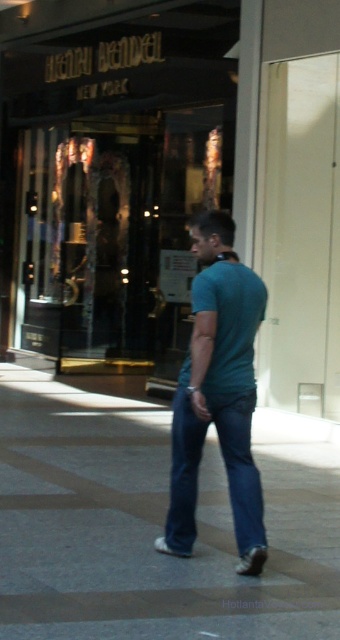
Is smooth concrete pavement at center above teal matte shirt at center?

Actually, smooth concrete pavement at center is below teal matte shirt at center.

Where is `smooth concrete pavement at center`? The width and height of the screenshot is (340, 640). smooth concrete pavement at center is located at coordinates (154, 522).

Between teal matte shirt at center and blue matte t-shirt at center, which one appears on the left side from the viewer's perspective?

teal matte shirt at center is more to the left.

Who is more forward, (259, 488) or (221, 376)?

Point (259, 488) is more forward.

You are a GUI agent. You are given a task and a screenshot of the screen. Output one action in this format:
    pyautogui.click(x=<x>, y=<y>)
    Task: Click on the teal matte shirt at center
    The width and height of the screenshot is (340, 640).
    Given the screenshot: What is the action you would take?
    pyautogui.click(x=217, y=394)

Can you confirm if smooth concrete pavement at center is wider than blue denim jeans at center?

No.

Is smooth concrete pavement at center thinner than blue denim jeans at center?

Yes, smooth concrete pavement at center is thinner than blue denim jeans at center.

Find the location of a particular element. Image resolution: width=340 pixels, height=640 pixels. smooth concrete pavement at center is located at coordinates (154, 522).

The width and height of the screenshot is (340, 640). In order to click on smooth concrete pavement at center in this screenshot , I will do `click(154, 522)`.